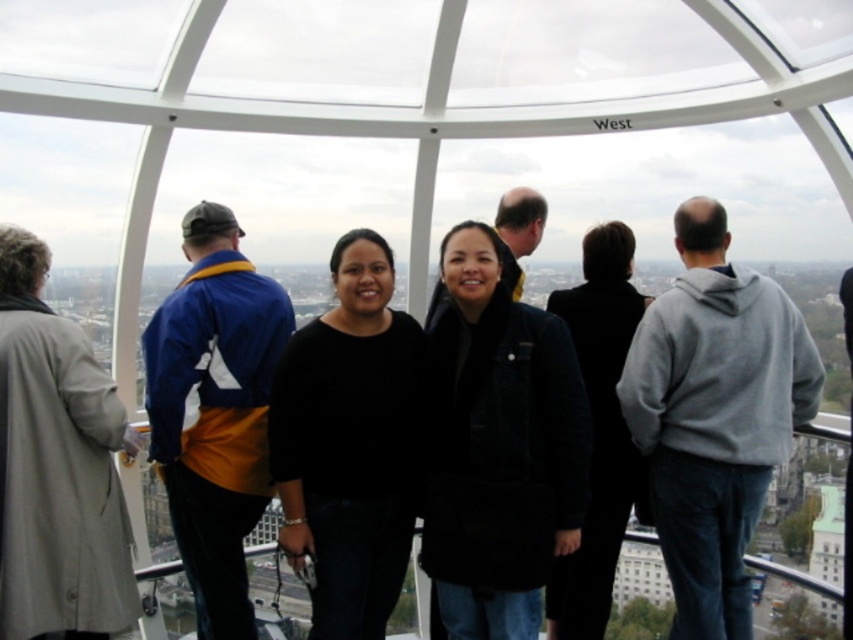
Question: Can you confirm if black denim jacket at center is positioned to the right of black wool coat at center?

Choices:
 (A) yes
 (B) no

Answer: (B)

Question: Can you confirm if black denim jacket at center is positioned below black matte sweater at center?

Choices:
 (A) yes
 (B) no

Answer: (B)

Question: Is the position of black denim jacket at center less distant than that of black matte sweater at center?

Choices:
 (A) no
 (B) yes

Answer: (B)

Question: Which point appears farthest from the camera in this image?

Choices:
 (A) (339, 346)
 (B) (561, 632)
 (C) (550, 428)

Answer: (A)

Question: Which of the following is the closest to the observer?

Choices:
 (A) black wool coat at center
 (B) black matte sweater at center

Answer: (B)

Question: Which of these objects is positioned closest to the black matte sweater at center?

Choices:
 (A) black denim jacket at center
 (B) black wool coat at center

Answer: (A)